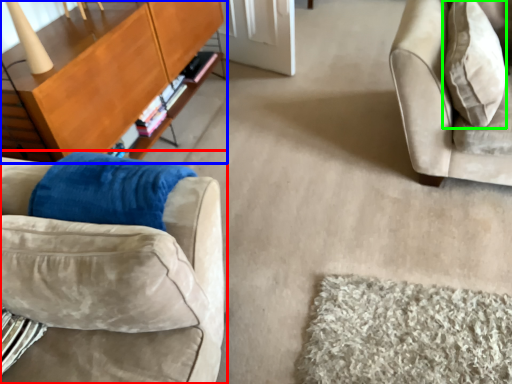
Question: Which is farther away from studio couch (highlighted by a red box)? table (highlighted by a blue box) or throw pillow (highlighted by a green box)?

Choices:
 (A) table
 (B) throw pillow

Answer: (B)